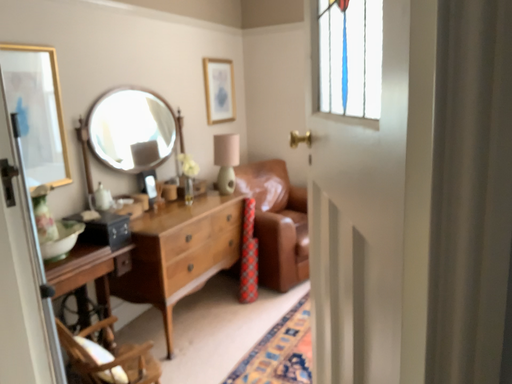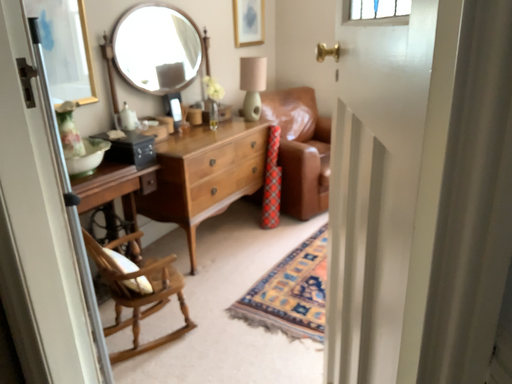
Question: Which way did the camera rotate in the video?

Choices:
 (A) rotated downward
 (B) rotated upward

Answer: (A)